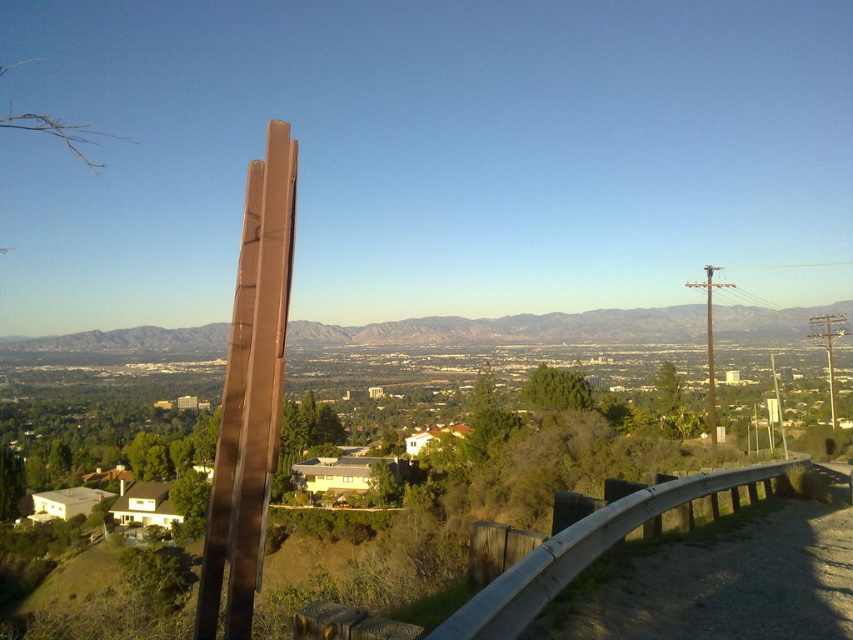
Between brown polished wood at center and brown matte mountain at center, which one appears on the left side from the viewer's perspective?

Positioned to the left is brown matte mountain at center.

Which is in front, point (218, 547) or point (213, 336)?

Point (218, 547) is in front.

The height and width of the screenshot is (640, 853). Identify the location of brown polished wood at center. (250, 390).